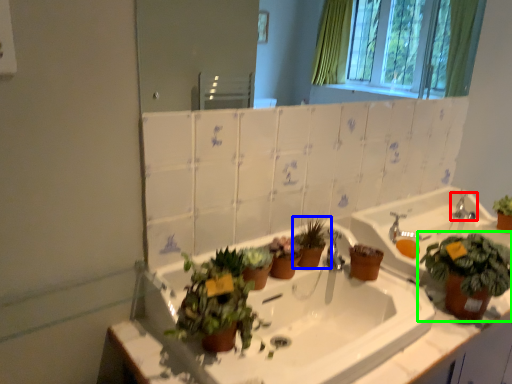
Question: Which object is positioned farthest from tap (highlighted by a red box)? Select from houseplant (highlighted by a blue box) and houseplant (highlighted by a green box).

Choices:
 (A) houseplant
 (B) houseplant

Answer: (A)